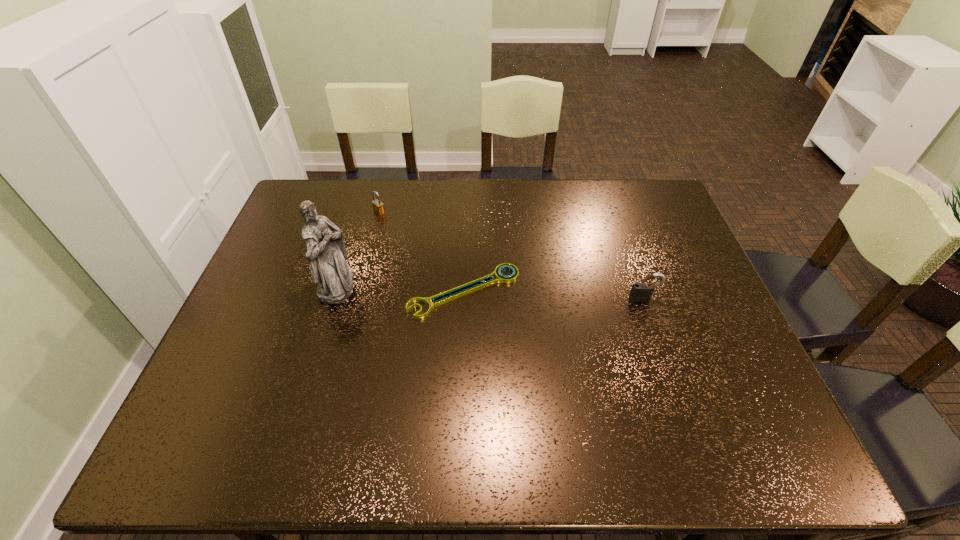
The image size is (960, 540). I want to click on free spot located on the left of the wrench, so click(346, 291).

At what (x,y) coordinates should I click in order to perform the action: click on object located at the far edge. Please return your answer as a coordinate pair (x, y). This screenshot has height=540, width=960. Looking at the image, I should click on pos(378,207).

The width and height of the screenshot is (960, 540). I want to click on object that is at the right edge, so click(x=640, y=292).

In the image, there is a desktop. Where is `vacant space at the far edge`? This screenshot has width=960, height=540. vacant space at the far edge is located at coordinates (476, 179).

Find the location of a particular element. free space at the left edge is located at coordinates (268, 354).

Locate an element on the screen. The image size is (960, 540). free location at the right edge of the desktop is located at coordinates (687, 382).

Locate an element on the screen. free space at the far right corner is located at coordinates (622, 200).

You are a GUI agent. You are given a task and a screenshot of the screen. Output one action in this format:
    pyautogui.click(x=<x>, y=<y>)
    Task: Click on the vacant point at the near right corner
    This screenshot has height=540, width=960.
    Given the screenshot: What is the action you would take?
    pyautogui.click(x=766, y=440)

You are a GUI agent. You are given a task and a screenshot of the screen. Output one action in this format:
    pyautogui.click(x=<x>, y=<y>)
    Task: Click on the blank region between the wrench and the figurine
    The image size is (960, 540).
    Given the screenshot: What is the action you would take?
    pyautogui.click(x=400, y=288)

At what (x,y) coordinates should I click in order to perform the action: click on empty location between the second object from right to left and the tallest object. Please return your answer as a coordinate pair (x, y). Image resolution: width=960 pixels, height=540 pixels. Looking at the image, I should click on (400, 288).